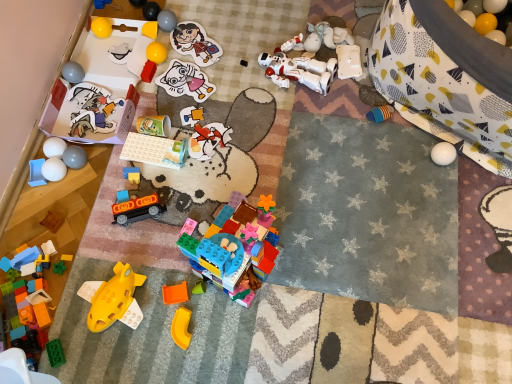
Find the location of a particular element. The width and height of the screenshot is (512, 384). free space that is in between matte blue plastic toy at center, marked as the thirteenth toy in a right-to-left arrangement, and white matte robot at upper center, positioned as the 23th toy in left-to-right order is located at coordinates (234, 114).